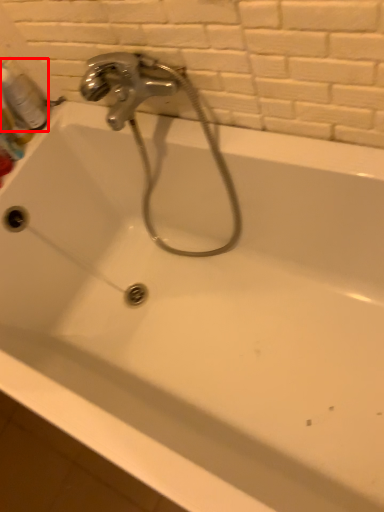
Question: Where is mouthwash (annotated by the red box) located in relation to plumbing fixture in the image?

Choices:
 (A) right
 (B) left

Answer: (B)